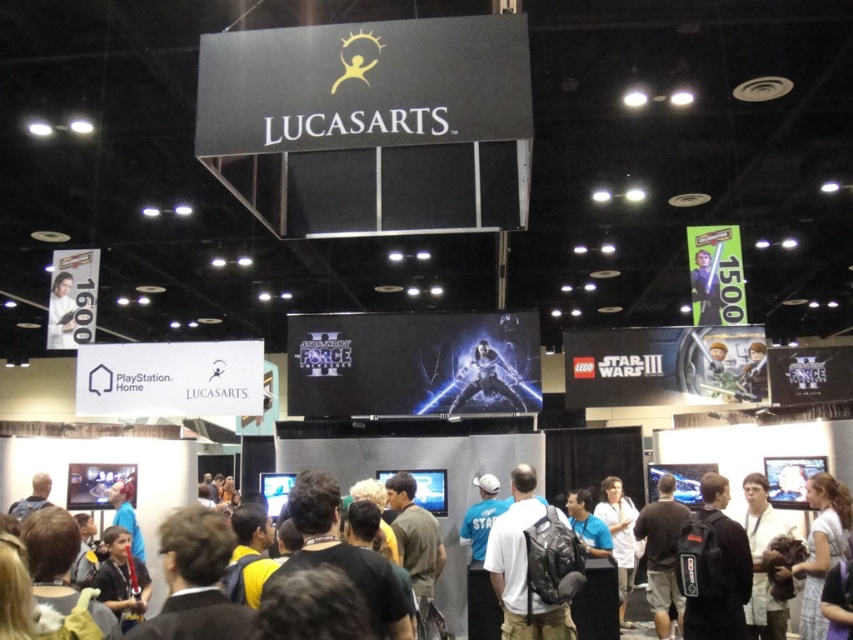
Is white matte backpack at center to the left of dark blue shirt at center from the viewer's perspective?

Indeed, white matte backpack at center is positioned on the left side of dark blue shirt at center.

Does white matte backpack at center have a greater height compared to dark blue shirt at center?

Indeed, white matte backpack at center has a greater height compared to dark blue shirt at center.

The height and width of the screenshot is (640, 853). Identify the location of white matte backpack at center. (532, 564).

Can you confirm if dark brown leather jacket at center is smaller than dark blue shirt at center?

No, dark brown leather jacket at center is not smaller than dark blue shirt at center.

Between dark brown leather jacket at center and dark blue shirt at center, which one appears on the left side from the viewer's perspective?

dark blue shirt at center

What do you see at coordinates (662, 554) in the screenshot? This screenshot has width=853, height=640. I see `dark brown leather jacket at center` at bounding box center [662, 554].

You are a GUI agent. You are given a task and a screenshot of the screen. Output one action in this format:
    pyautogui.click(x=<x>, y=<y>)
    Task: Click on the dark brown leather jacket at center
    Image resolution: width=853 pixels, height=640 pixels.
    Given the screenshot: What is the action you would take?
    pyautogui.click(x=662, y=554)

Is point (677, 529) positioned before point (51, 282)?

Yes, it is in front of point (51, 282).

Who is shorter, dark brown leather jacket at center or white matte poster at upper left?

Standing shorter between the two is white matte poster at upper left.

Is point (663, 536) farther from camera compared to point (54, 340)?

No, it is not.

Locate an element on the screen. dark brown leather jacket at center is located at coordinates (662, 554).